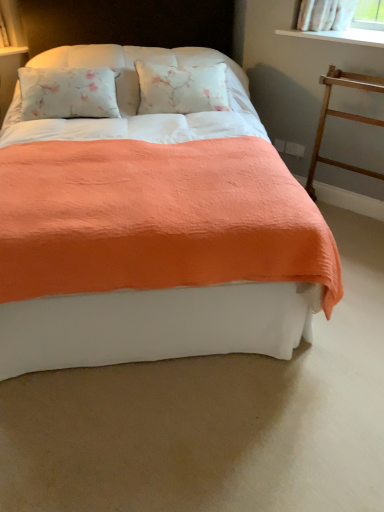
Question: Is point (365, 39) positioned closer to the camera than point (223, 216)?

Choices:
 (A) farther
 (B) closer

Answer: (A)

Question: Considering the positions of white smooth window sill at upper right and coral fabric bed at center in the image, is white smooth window sill at upper right wider or thinner than coral fabric bed at center?

Choices:
 (A) thin
 (B) wide

Answer: (A)

Question: Estimate the real-world distances between objects in this image. Which object is farther from the white smooth window sill at upper right?

Choices:
 (A) coral fabric bed at center
 (B) wooden at right

Answer: (A)

Question: Considering the real-world distances, which object is farthest from the wooden at right?

Choices:
 (A) white smooth window sill at upper right
 (B) coral fabric bed at center

Answer: (B)